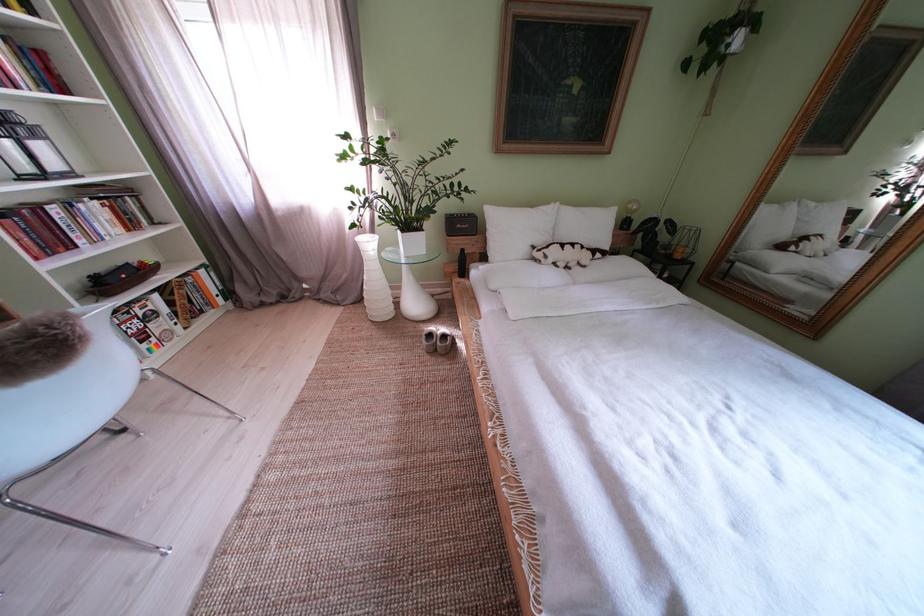
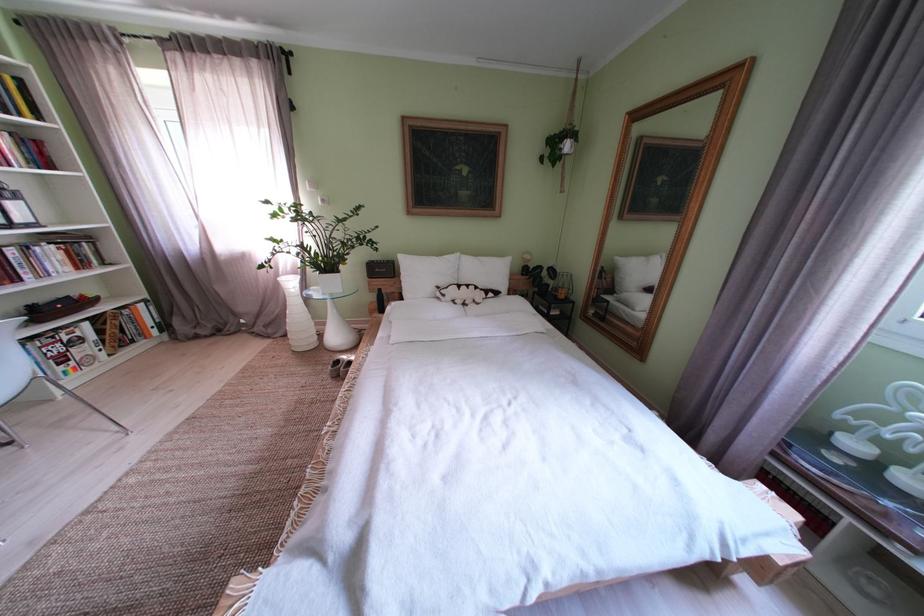
Locate, in the second image, the point that corresponds to point (520, 237) in the first image.

(429, 280)